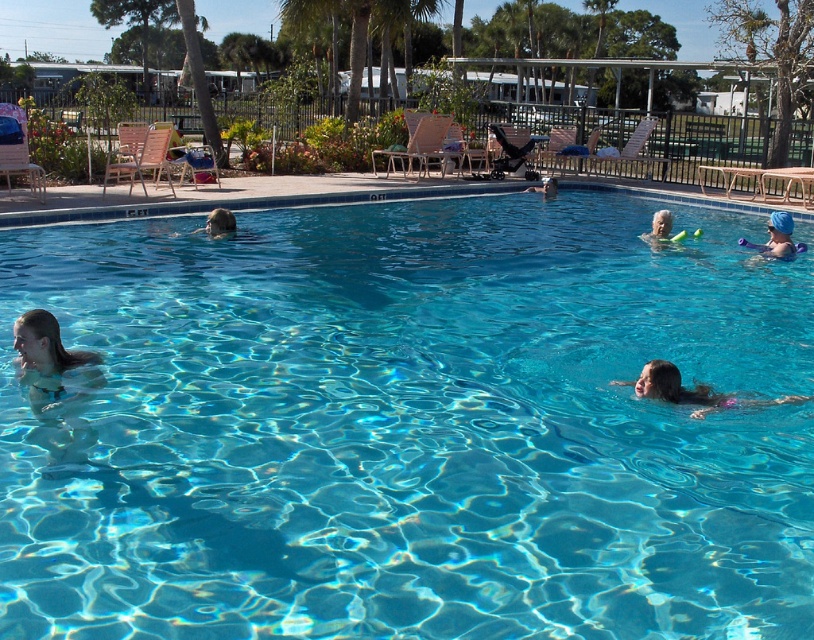
Question: Is blue rubber swim cap at upper right closer to the viewer compared to smooth skin head at center?

Choices:
 (A) no
 (B) yes

Answer: (B)

Question: Which of the following is the closest to the observer?

Choices:
 (A) blue rubber swim cap at upper right
 (B) light brown hair at lower left
 (C) white rubber ring at upper right
 (D) smooth skin head at center

Answer: (B)

Question: Which of these objects is positioned closest to the smooth skin girl at lower center?

Choices:
 (A) transparent blue water at center
 (B) blue rubber swim cap at upper right
 (C) light brown hair at lower left
 (D) white rubber ring at upper right

Answer: (A)

Question: Is blue rubber swim cap at upper right further to camera compared to white rubber ring at upper right?

Choices:
 (A) no
 (B) yes

Answer: (A)

Question: Can you confirm if white rubber ring at upper right is positioned to the left of smooth skin head at center?

Choices:
 (A) no
 (B) yes

Answer: (A)

Question: Which object is positioned closest to the smooth skin person at center?

Choices:
 (A) transparent blue water at center
 (B) smooth skin girl at lower center

Answer: (A)